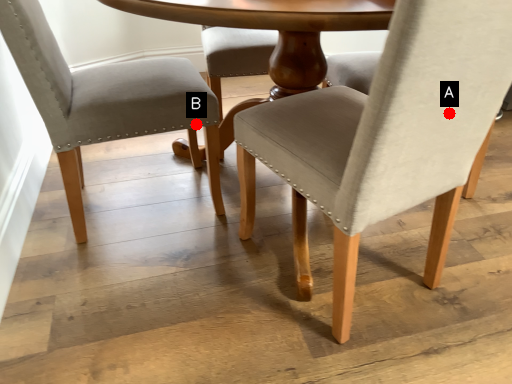
Question: Two points are circled on the image, labeled by A and B beside each circle. Which point is closer to the camera taking this photo?

Choices:
 (A) A is closer
 (B) B is closer

Answer: (A)